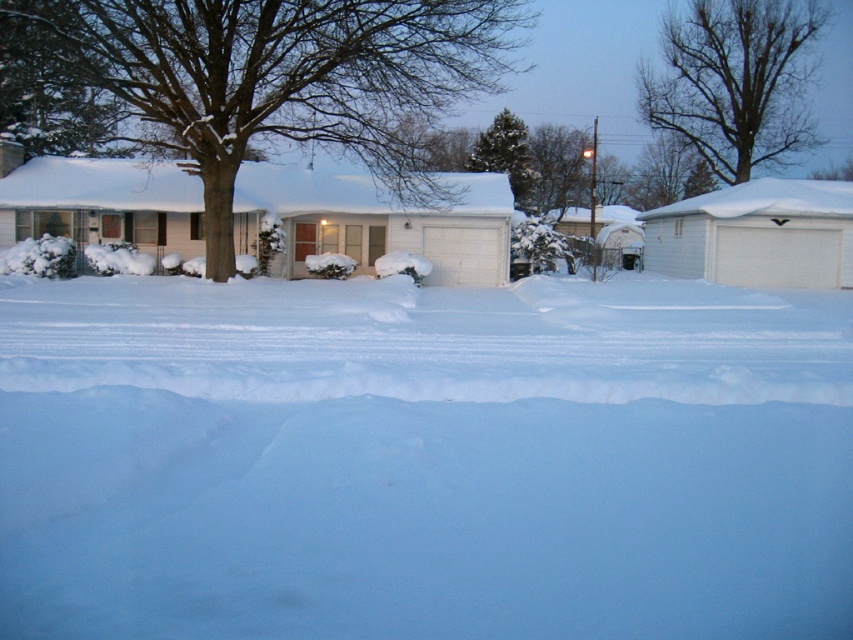
The image size is (853, 640). What do you see at coordinates (274, 77) in the screenshot?
I see `brown textured tree at center` at bounding box center [274, 77].

In order to click on brown textured tree at center in this screenshot , I will do `click(274, 77)`.

Between point (746, 115) and point (502, 112), which one is positioned in front?

Point (746, 115)

Who is shorter, bare branches at upper center or green textured pine tree at upper center?

With less height is green textured pine tree at upper center.

Image resolution: width=853 pixels, height=640 pixels. What do you see at coordinates (735, 81) in the screenshot?
I see `bare branches at upper center` at bounding box center [735, 81].

Find the location of `bare branches at upper center`. bare branches at upper center is located at coordinates (735, 81).

Is white fluffy snow at center above brown textured tree at center?

Actually, white fluffy snow at center is below brown textured tree at center.

Is white fluffy snow at center to the left of brown textured tree at center from the viewer's perspective?

No, white fluffy snow at center is not to the left of brown textured tree at center.

Is point (332, 426) in front of point (218, 163)?

Yes.

Locate an element on the screen. Image resolution: width=853 pixels, height=640 pixels. white fluffy snow at center is located at coordinates (422, 458).